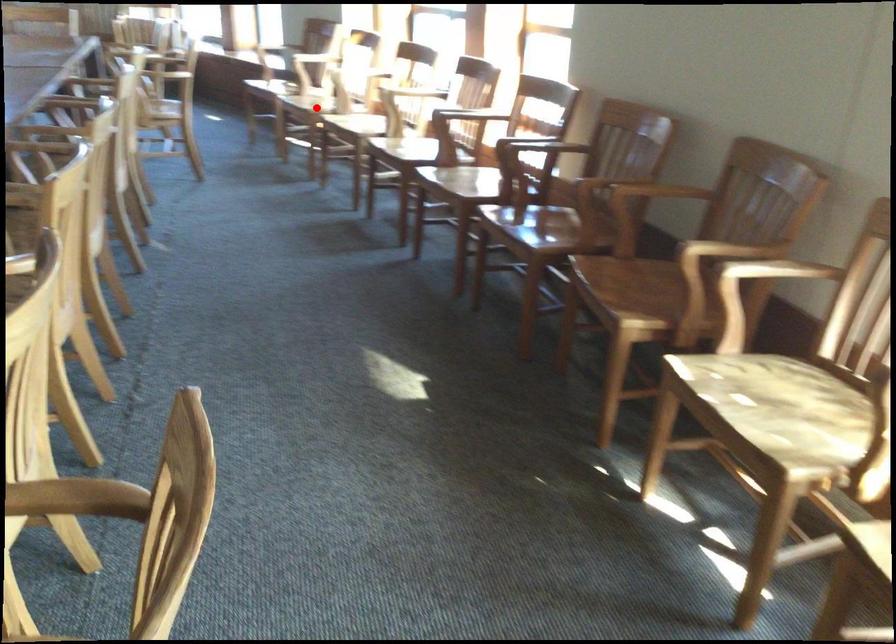
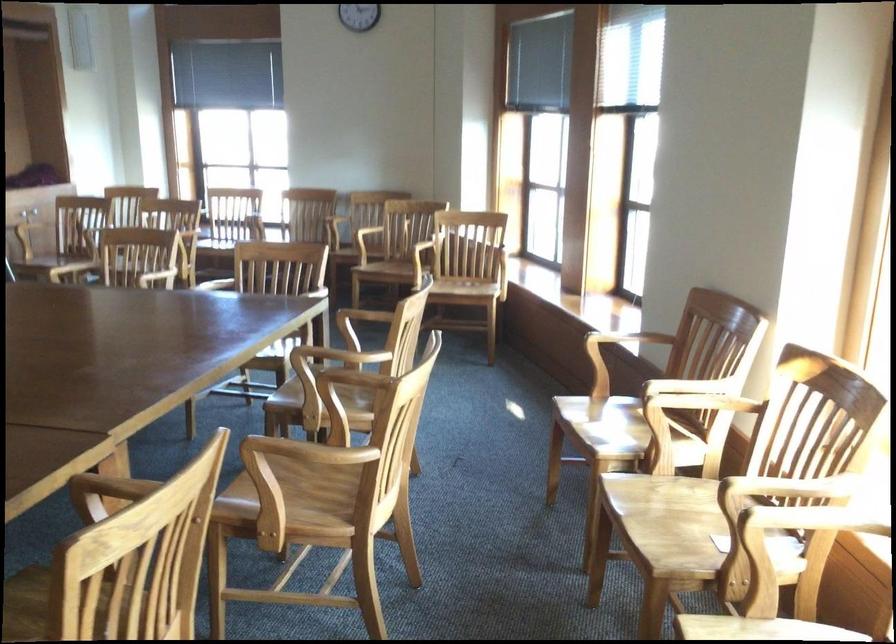
Question: I am providing you with two images of the same scene from different viewpoints. A red point is marked on the first image. Is the red point's position out of view in image 2?

Choices:
 (A) Yes
 (B) No

Answer: (B)